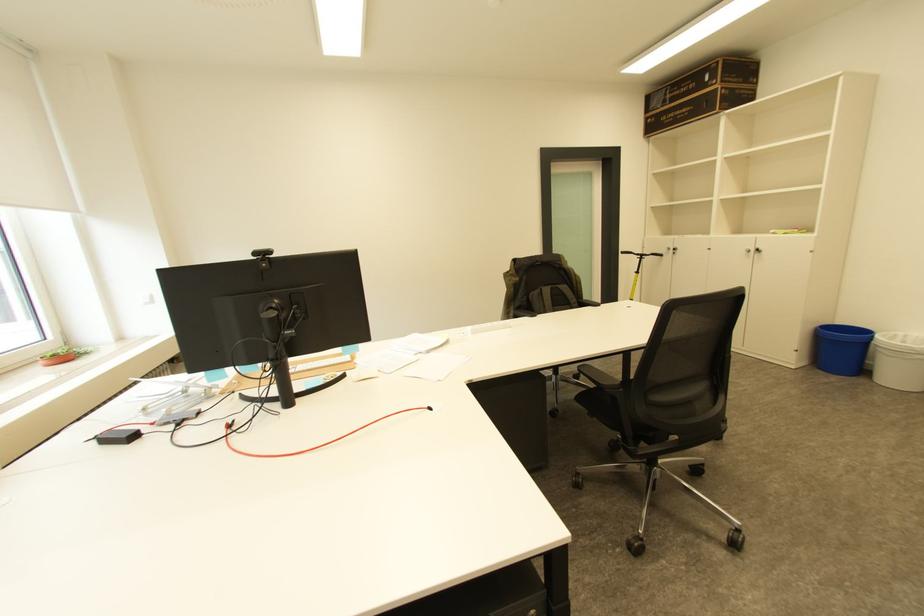
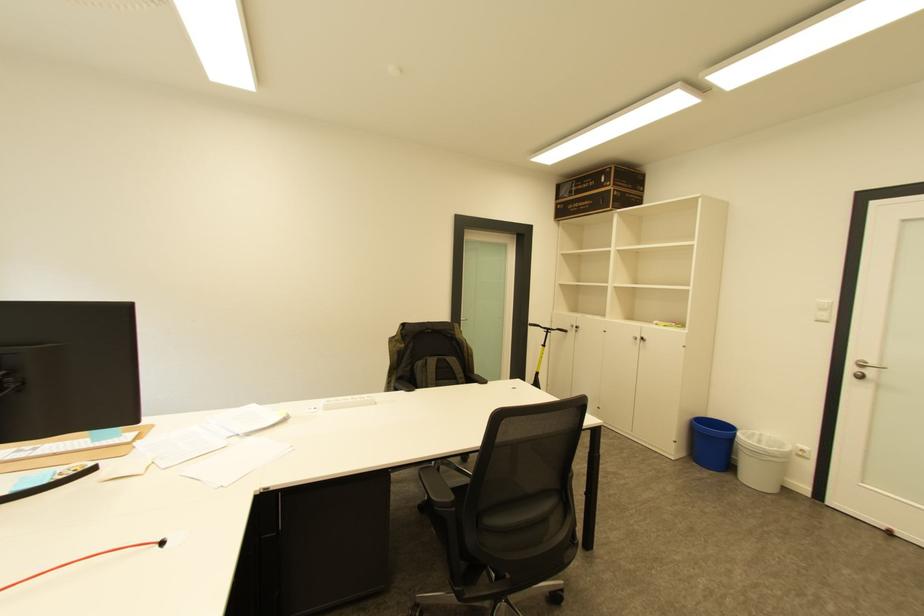
Which direction would the cameraman need to move to produce the second image?

The cameraman walked toward right, forward.